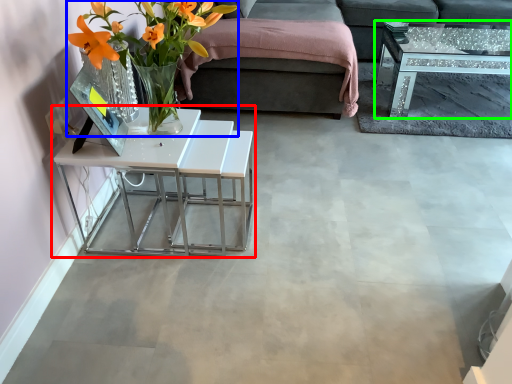
Question: Considering the real-world distances, which object is farthest from table (highlighted by a red box)? floral arrangement (highlighted by a blue box) or coffee table (highlighted by a green box)?

Choices:
 (A) floral arrangement
 (B) coffee table

Answer: (B)